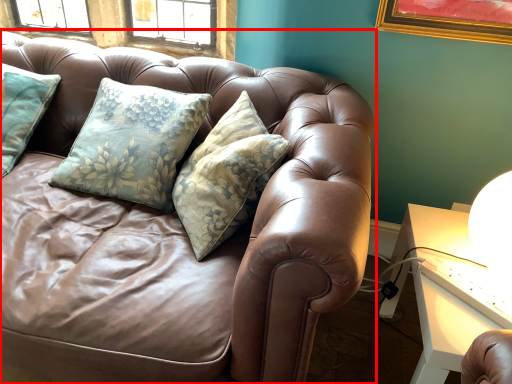
Question: Observing the image, what is the correct spatial positioning of studio couch (annotated by the red box) in reference to table?

Choices:
 (A) left
 (B) right

Answer: (A)